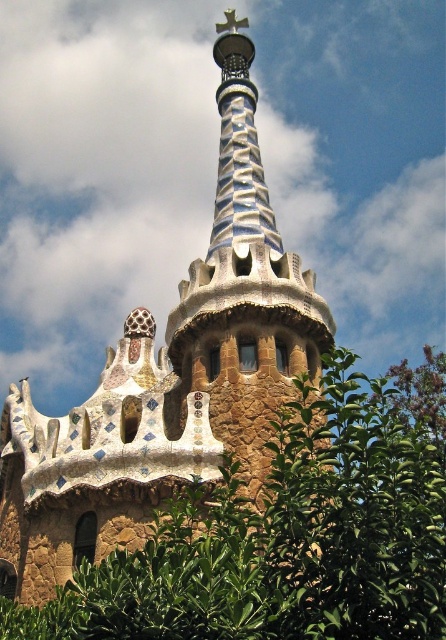
Question: Is green leafy tree at center to the left of multicolored mosaic tower at center from the viewer's perspective?

Choices:
 (A) no
 (B) yes

Answer: (A)

Question: Which of the following is the farthest from the observer?

Choices:
 (A) (136, 504)
 (B) (221, 605)

Answer: (A)

Question: Is green leafy tree at center above multicolored mosaic tower at center?

Choices:
 (A) yes
 (B) no

Answer: (B)

Question: Is green leafy tree at center behind multicolored mosaic tower at center?

Choices:
 (A) yes
 (B) no

Answer: (B)